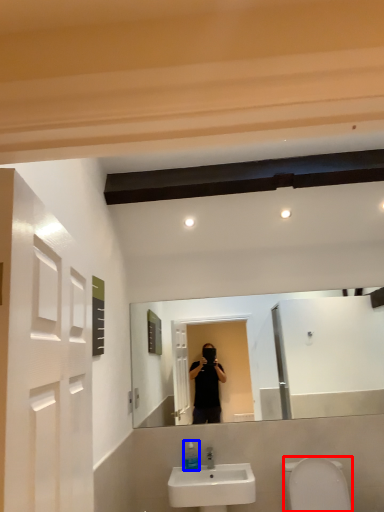
Question: Which point is further to the camera, toilet bowl (highlighted by a red box) or soap dispenser (highlighted by a blue box)?

Choices:
 (A) toilet bowl
 (B) soap dispenser

Answer: (B)